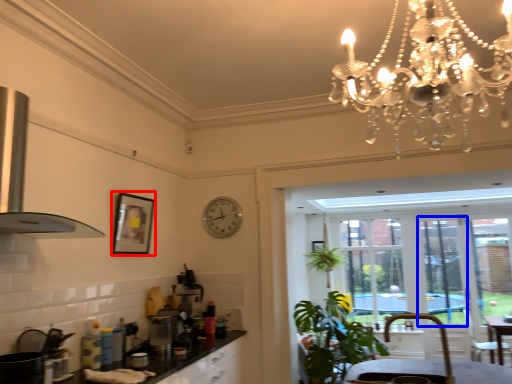
Question: Which of the following is the farthest to the observer, picture frame (highlighted by a red box) or window screen (highlighted by a blue box)?

Choices:
 (A) picture frame
 (B) window screen

Answer: (B)